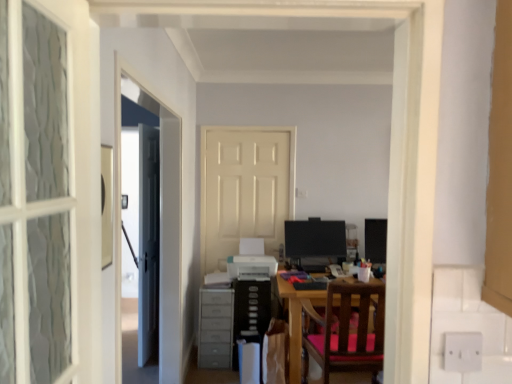
Find the location of a particular element. Image resolution: width=512 pixels, height=384 pixels. white matte door at center, which is the first door in back-to-front order is located at coordinates (245, 189).

What is the approximate height of white matte door at center, which is the first door in back-to-front order?

white matte door at center, which is the first door in back-to-front order, is 1.81 meters tall.

The image size is (512, 384). What do you see at coordinates (148, 243) in the screenshot?
I see `white glossy door at center, the 1th door positioned from the left` at bounding box center [148, 243].

Consider the image. What is the approximate height of gray plastic dresser at lower left?

It is 26.12 inches.

Where is `matte black monitor at right, which is counted as the 1th computer monitor, starting from the right`? matte black monitor at right, which is counted as the 1th computer monitor, starting from the right is located at coordinates (376, 240).

What do you see at coordinates (251, 261) in the screenshot?
I see `white glossy printer at center` at bounding box center [251, 261].

Where is `white matte door at center, marked as the 1th door in a right-to-left arrangement`? This screenshot has width=512, height=384. white matte door at center, marked as the 1th door in a right-to-left arrangement is located at coordinates (245, 189).

The height and width of the screenshot is (384, 512). Find the location of `printer below the white matte door at center, the second door from the front (from a real-world perspective)`. printer below the white matte door at center, the second door from the front (from a real-world perspective) is located at coordinates (251, 261).

From their relative heights in the image, would you say white glossy printer at center is taller or shorter than white matte door at center, which is the first door in back-to-front order?

white glossy printer at center is shorter than white matte door at center, which is the first door in back-to-front order.

From a real-world perspective, is white glossy printer at center located higher than white matte door at center, the 2th door positioned from the left?

No.

Is white matte door at center, the second door from the front, positioned far away from wooden chair with pink cushion at center?

Yes, white matte door at center, the second door from the front, and wooden chair with pink cushion at center are quite far apart.

Can you confirm if white matte door at center, the second door from the front, is positioned to the right of wooden chair with pink cushion at center?

In fact, white matte door at center, the second door from the front, is to the left of wooden chair with pink cushion at center.

Could you tell me if white matte door at center, marked as the 1th door in a right-to-left arrangement, is facing wooden chair with pink cushion at center?

No, white matte door at center, marked as the 1th door in a right-to-left arrangement, is not facing towards wooden chair with pink cushion at center.

How much distance is there between white matte door at center, marked as the 1th door in a right-to-left arrangement, and wooden chair with pink cushion at center?

white matte door at center, marked as the 1th door in a right-to-left arrangement, and wooden chair with pink cushion at center are 1.31 meters apart.

Which object is further away from the camera taking this photo, wooden chair with pink cushion at center or matte black monitor at center, arranged as the first computer monitor when viewed from the left?

matte black monitor at center, arranged as the first computer monitor when viewed from the left, is further from the camera.

Does point (340, 305) come closer to viewer compared to point (295, 224)?

That is True.

Is wooden chair with pink cushion at center next to matte black monitor at center, placed as the 2th computer monitor when sorted from right to left?

No.

From a real-world perspective, is wooden chair with pink cushion at center above or below matte black monitor at center, arranged as the first computer monitor when viewed from the left?

In terms of real-world spatial position, wooden chair with pink cushion at center is below matte black monitor at center, arranged as the first computer monitor when viewed from the left.

Is white glossy printer at center taller or shorter than matte black monitor at right, placed as the second computer monitor when sorted from left to right?

In the image, white glossy printer at center appears to be shorter than matte black monitor at right, placed as the second computer monitor when sorted from left to right.

From a real-world perspective, is white glossy printer at center located beneath matte black monitor at right, placed as the second computer monitor when sorted from left to right?

Yes, from a real-world perspective, white glossy printer at center is under matte black monitor at right, placed as the second computer monitor when sorted from left to right.

Is white glossy printer at center looking in the opposite direction of matte black monitor at right, placed as the second computer monitor when sorted from left to right?

white glossy printer at center does not have its back to matte black monitor at right, placed as the second computer monitor when sorted from left to right.

Measure the distance from white glossy printer at center to matte black monitor at right, placed as the second computer monitor when sorted from left to right.

38.00 inches.

Who is taller, white matte door at center, the second door from the front, or matte black monitor at center, arranged as the first computer monitor when viewed from the left?

white matte door at center, the second door from the front, is taller.

Considering the sizes of objects white matte door at center, the second door from the front, and matte black monitor at center, arranged as the first computer monitor when viewed from the left, in the image provided, who is smaller, white matte door at center, the second door from the front, or matte black monitor at center, arranged as the first computer monitor when viewed from the left,?

white matte door at center, the second door from the front.

Looking at their sizes, would you say white matte door at center, marked as the 1th door in a right-to-left arrangement, is wider or thinner than matte black monitor at center, arranged as the first computer monitor when viewed from the left?

white matte door at center, marked as the 1th door in a right-to-left arrangement, is thinner than matte black monitor at center, arranged as the first computer monitor when viewed from the left.

Is point (263, 229) less distant than point (323, 222)?

That is False.

Which object is closer to the camera taking this photo, wooden chair with pink cushion at center or white glossy printer at center?

wooden chair with pink cushion at center.

Locate an element on the screen. The width and height of the screenshot is (512, 384). printer on the left of wooden chair with pink cushion at center is located at coordinates (251, 261).

From the image's perspective, does wooden chair with pink cushion at center appear lower than white glossy printer at center?

Indeed, from the image's perspective, wooden chair with pink cushion at center is shown beneath white glossy printer at center.

Consider the image. Considering the sizes of objects wooden chair with pink cushion at center and white glossy printer at center in the image provided, who is taller, wooden chair with pink cushion at center or white glossy printer at center?

wooden chair with pink cushion at center.

Is white glossy printer at center turned away from matte black monitor at center, placed as the 2th computer monitor when sorted from right to left?

That's not correct — white glossy printer at center is not looking away from matte black monitor at center, placed as the 2th computer monitor when sorted from right to left.

Who is taller, white glossy printer at center or matte black monitor at center, arranged as the first computer monitor when viewed from the left?

Standing taller between the two is matte black monitor at center, arranged as the first computer monitor when viewed from the left.

Between white glossy printer at center and matte black monitor at center, arranged as the first computer monitor when viewed from the left, which one is positioned behind?

matte black monitor at center, arranged as the first computer monitor when viewed from the left.

Does point (229, 264) appear closer or farther from the camera than point (334, 255)?

Point (229, 264).

Identify the location of printer on the right side of white matte door at center, marked as the 1th door in a right-to-left arrangement. (251, 261).

Where is `the 2nd door located above the wooden chair with pink cushion at center (from a real-world perspective)`? The height and width of the screenshot is (384, 512). the 2nd door located above the wooden chair with pink cushion at center (from a real-world perspective) is located at coordinates (245, 189).

From the image, which object appears to be nearer to wooden chair with pink cushion at center, gray plastic dresser at lower left or white glossy printer at center?

gray plastic dresser at lower left is closer to wooden chair with pink cushion at center.

Estimate the real-world distances between objects in this image. Which object is closer to white glossy printer at center, matte black monitor at center, arranged as the first computer monitor when viewed from the left, or white matte door at center, the 2th door positioned from the left?

The object closer to white glossy printer at center is matte black monitor at center, arranged as the first computer monitor when viewed from the left.

From the image, which object appears to be nearer to white matte door at center, the 2th door positioned from the left, gray plastic dresser at lower left or matte black monitor at right, which is counted as the 1th computer monitor, starting from the right?

gray plastic dresser at lower left is positioned closer to the anchor white matte door at center, the 2th door positioned from the left.

Looking at this image, from the image, which object appears to be nearer to white glossy printer at center, gray plastic dresser at lower left or matte black monitor at right, which is counted as the 1th computer monitor, starting from the right?

gray plastic dresser at lower left is positioned closer to the anchor white glossy printer at center.

From the picture: Looking at the image, which one is located further to white matte door at center, the 2th door positioned from the left, white glossy printer at center or matte black monitor at right, placed as the second computer monitor when sorted from left to right?

Based on the image, matte black monitor at right, placed as the second computer monitor when sorted from left to right, appears to be further to white matte door at center, the 2th door positioned from the left.

Which object lies further to the anchor point matte black monitor at center, placed as the 2th computer monitor when sorted from right to left, white glossy door at center, positioned as the second door in back-to-front order, or matte black monitor at right, placed as the second computer monitor when sorted from left to right?

white glossy door at center, positioned as the second door in back-to-front order, lies further to matte black monitor at center, placed as the 2th computer monitor when sorted from right to left, than the other object.

Consider the image. Considering their positions, is white glossy printer at center positioned further to matte black monitor at center, arranged as the first computer monitor when viewed from the left, than wooden chair with pink cushion at center?

Among the two, wooden chair with pink cushion at center is located further to matte black monitor at center, arranged as the first computer monitor when viewed from the left.

Looking at the image, which one is located further to matte black monitor at right, placed as the second computer monitor when sorted from left to right, wooden chair with pink cushion at center or white glossy printer at center?

Among the two, wooden chair with pink cushion at center is located further to matte black monitor at right, placed as the second computer monitor when sorted from left to right.

Where is `printer between wooden chair with pink cushion at center and matte black monitor at center, placed as the 2th computer monitor when sorted from right to left, along the z-axis`? Image resolution: width=512 pixels, height=384 pixels. printer between wooden chair with pink cushion at center and matte black monitor at center, placed as the 2th computer monitor when sorted from right to left, along the z-axis is located at coordinates pos(251,261).

This screenshot has height=384, width=512. I want to click on computer monitor situated between white matte door at center, the second door from the front, and matte black monitor at right, placed as the second computer monitor when sorted from left to right, from left to right, so click(315, 243).

Find the location of `door between white glossy door at center, the 1th door positioned from the left, and wooden chair with pink cushion at center`. door between white glossy door at center, the 1th door positioned from the left, and wooden chair with pink cushion at center is located at coordinates (245, 189).

You are a GUI agent. You are given a task and a screenshot of the screen. Output one action in this format:
    pyautogui.click(x=<x>, y=<y>)
    Task: Click on the dresser between wooden chair with pink cushion at center and white matte door at center, the 2th door positioned from the left, along the z-axis
    The image size is (512, 384).
    Given the screenshot: What is the action you would take?
    (215, 328)